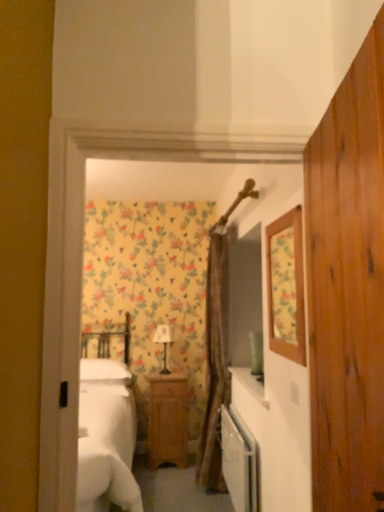
In order to click on white glossy dishwasher at center in this screenshot , I will do `click(239, 461)`.

In order to face white glossy dishwasher at center, should I rotate leftwards or rightwards?

It's best to rotate right around 5.686 degrees.

What do you see at coordinates (164, 343) in the screenshot? This screenshot has height=512, width=384. I see `matte white lamp at center` at bounding box center [164, 343].

Describe the element at coordinates (167, 420) in the screenshot. I see `wooden nightstand at center` at that location.

You are a GUI agent. You are given a task and a screenshot of the screen. Output one action in this format:
    pyautogui.click(x=<x>, y=<y>)
    Task: Click on the wooden nightstand at center
    This screenshot has width=384, height=512.
    Given the screenshot: What is the action you would take?
    pyautogui.click(x=167, y=420)

Describe the element at coordinates (286, 286) in the screenshot. I see `floral wallpaper mirror at upper right` at that location.

What is the approximate width of wooden dresser at center?

wooden dresser at center is 1.94 inches in width.

Image resolution: width=384 pixels, height=512 pixels. What are the coordinates of `white glossy dishwasher at center` in the screenshot? It's located at (239, 461).

Based on their positions, is wooden dresser at center located to the left or right of wooden nightstand at center?

Based on their positions, wooden dresser at center is located to the right of wooden nightstand at center.

In the scene shown: Which of these two, wooden dresser at center or wooden nightstand at center, is thinner?

wooden dresser at center.

Is wooden dresser at center looking in the opposite direction of wooden nightstand at center?

No, wooden dresser at center's orientation is not away from wooden nightstand at center.

Is matte white lamp at center taller or shorter than wooden dresser at center?

matte white lamp at center is shorter than wooden dresser at center.

Do you think matte white lamp at center is within wooden dresser at center, or outside of it?

matte white lamp at center is outside wooden dresser at center.

Is matte white lamp at center wider or thinner than wooden dresser at center?

matte white lamp at center is wider than wooden dresser at center.

Does matte white lamp at center come in front of wooden dresser at center?

No, the depth of matte white lamp at center is greater than that of wooden dresser at center.

Are wooden nightstand at center and floral wallpaper mirror at upper right far apart?

wooden nightstand at center is positioned a significant distance from floral wallpaper mirror at upper right.

Which point is more distant from viewer, (159, 464) or (277, 277)?

The point (277, 277) is behind.

Which of these two, wooden nightstand at center or floral wallpaper mirror at upper right, is thinner?

floral wallpaper mirror at upper right.

Who is smaller, wooden nightstand at center or floral wallpaper mirror at upper right?

With smaller size is floral wallpaper mirror at upper right.

Is point (278, 249) positioned behind point (254, 495)?

Yes, point (278, 249) is behind point (254, 495).

From the image's perspective, is floral wallpaper mirror at upper right over white glossy dishwasher at center?

Yes.

Which of these two, floral wallpaper mirror at upper right or white glossy dishwasher at center, stands taller?

floral wallpaper mirror at upper right is taller.

Is floral wallpaper mirror at upper right bigger than white glossy dishwasher at center?

Actually, floral wallpaper mirror at upper right might be smaller than white glossy dishwasher at center.

Between wooden dresser at center and floral wallpaper mirror at upper right, which one appears on the right side from the viewer's perspective?

floral wallpaper mirror at upper right.

Is floral wallpaper mirror at upper right a part of wooden dresser at center?

That's incorrect, floral wallpaper mirror at upper right is not inside wooden dresser at center.

Which of these two, wooden dresser at center or floral wallpaper mirror at upper right, is thinner?

Thinner between the two is floral wallpaper mirror at upper right.

Which is in front, wooden dresser at center or floral wallpaper mirror at upper right?

wooden dresser at center.

Does white glossy dishwasher at center appear on the left side of floral wallpaper mirror at upper right?

Indeed, white glossy dishwasher at center is positioned on the left side of floral wallpaper mirror at upper right.

Based on the photo, is white glossy dishwasher at center aimed at floral wallpaper mirror at upper right?

No, white glossy dishwasher at center is not aimed at floral wallpaper mirror at upper right.

From a real-world perspective, which object rests below the other?

In real-world perspective, white glossy dishwasher at center is lower.

Considering the relative positions of white glossy dishwasher at center and floral wallpaper mirror at upper right in the image provided, is white glossy dishwasher at center behind floral wallpaper mirror at upper right?

Yes.

Based on the photo, measure the distance between floral wallpaper mirror at upper right and brown textured curtain at center.

35.32 inches.

Is floral wallpaper mirror at upper right facing away from brown textured curtain at center?

No, floral wallpaper mirror at upper right is not facing away from brown textured curtain at center.

Is point (296, 288) closer or farther from the camera than point (209, 424)?

Point (296, 288) appears to be farther away from the viewer than point (209, 424).

Consider the image. From the image's perspective, is floral wallpaper mirror at upper right located above brown textured curtain at center?

Indeed, from the image's perspective, floral wallpaper mirror at upper right is shown above brown textured curtain at center.

Locate an element on the screen. The width and height of the screenshot is (384, 512). dresser on the right of wooden nightstand at center is located at coordinates (348, 287).

The image size is (384, 512). I want to click on lamp on the left of wooden dresser at center, so click(x=164, y=343).

Considering their positions, is wooden nightstand at center positioned further to floral wallpaper mirror at upper right than white glossy dishwasher at center?

white glossy dishwasher at center is positioned further to the anchor floral wallpaper mirror at upper right.

Considering their positions, is matte white lamp at center positioned further to brown textured curtain at center than wooden nightstand at center?

Among the two, matte white lamp at center is located further to brown textured curtain at center.

From the image, which object appears to be farther from white glossy dishwasher at center, matte white lamp at center or wooden nightstand at center?

matte white lamp at center is further to white glossy dishwasher at center.

Which object lies nearer to the anchor point matte white lamp at center, brown textured curtain at center or wooden dresser at center?

brown textured curtain at center is positioned closer to the anchor matte white lamp at center.

Which object lies nearer to the anchor point wooden nightstand at center, brown textured curtain at center or wooden dresser at center?

brown textured curtain at center lies closer to wooden nightstand at center than the other object.

Looking at the image, which one is located closer to wooden dresser at center, floral wallpaper mirror at upper right or wooden nightstand at center?

The object closer to wooden dresser at center is floral wallpaper mirror at upper right.

Which object lies further to the anchor point wooden nightstand at center, wooden dresser at center or matte white lamp at center?

The object further to wooden nightstand at center is wooden dresser at center.

Which object lies nearer to the anchor point matte white lamp at center, wooden nightstand at center or wooden dresser at center?

wooden nightstand at center is closer to matte white lamp at center.

The width and height of the screenshot is (384, 512). I want to click on dish washer located between floral wallpaper mirror at upper right and wooden nightstand at center in the depth direction, so click(239, 461).

Identify the location of dish washer between floral wallpaper mirror at upper right and brown textured curtain at center from front to back. (239, 461).

The height and width of the screenshot is (512, 384). What are the coordinates of `dish washer between floral wallpaper mirror at upper right and matte white lamp at center along the z-axis` in the screenshot? It's located at (239, 461).

Where is `nightstand between white glossy dishwasher at center and matte white lamp at center along the z-axis`? This screenshot has height=512, width=384. nightstand between white glossy dishwasher at center and matte white lamp at center along the z-axis is located at coordinates (167, 420).